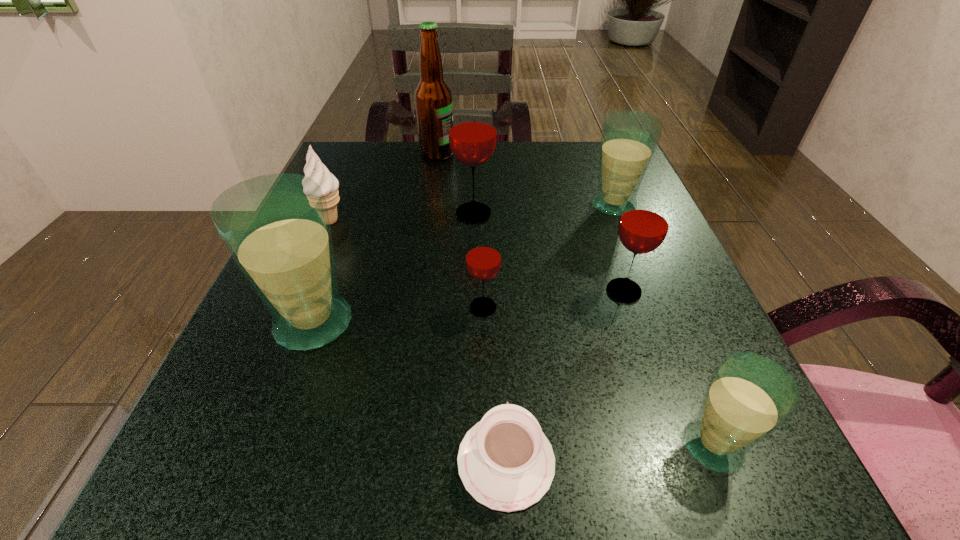
Identify which red glass is the second closest to the second smallest blue glass. Please provide its 2D coordinates. Your answer should be formatted as a tuple, i.e. [(x, y)], where the tuple contains the x and y coordinates of a point satisfying the conditions above.

[(472, 130)]

Locate an element on the screen. This screenshot has width=960, height=540. red glass object that ranks as the closest to the rightmost red glass is located at coordinates (483, 260).

The height and width of the screenshot is (540, 960). I want to click on the second closest blue glass to the second farthest blue glass, so click(629, 139).

Identify the location of blue glass that stands as the second closest to the icecream. (629, 139).

The image size is (960, 540). In order to click on vacant space that satisfies the following two spatial constraints: 1. on the back side of the smallest red glass; 2. on the left side of the rightmost red glass in this screenshot , I will do `click(483, 291)`.

Find the location of a particular element. The height and width of the screenshot is (540, 960). free spot that satisfies the following two spatial constraints: 1. on the handle side of the shortest object; 2. on the front-facing side of the icecream is located at coordinates (495, 220).

At what (x,y) coordinates should I click in order to perform the action: click on free space that satisfies the following two spatial constraints: 1. on the back side of the smallest red glass; 2. on the label of the farthest object. Please return your answer as a coordinate pair (x, y). This screenshot has height=540, width=960. Looking at the image, I should click on (482, 154).

This screenshot has width=960, height=540. I want to click on free location that satisfies the following two spatial constraints: 1. on the label of the seventh object from right to left; 2. on the handle side of the teacup, so click(x=392, y=461).

At what (x,y) coordinates should I click in order to perform the action: click on vacant space that satisfies the following two spatial constraints: 1. on the back side of the second biggest red glass; 2. on the right side of the second farthest blue glass. Please return your answer as a coordinate pair (x, y). The width and height of the screenshot is (960, 540). Looking at the image, I should click on (325, 291).